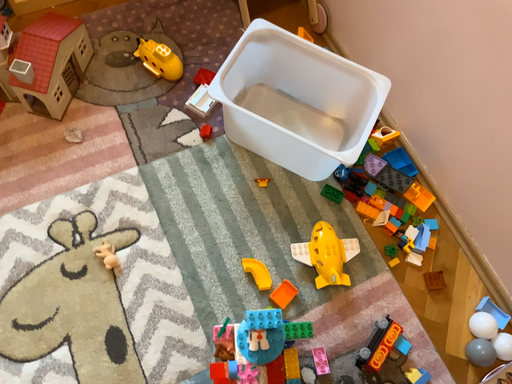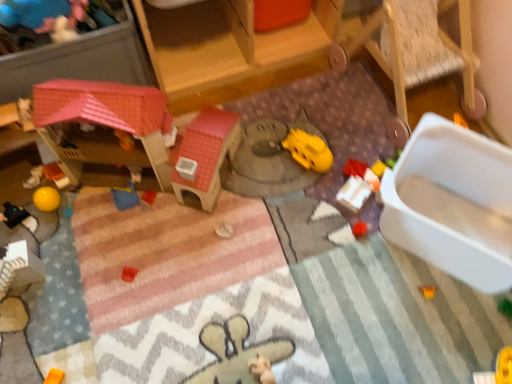
Question: How did the camera likely rotate when shooting the video?

Choices:
 (A) rotated right
 (B) rotated left

Answer: (B)